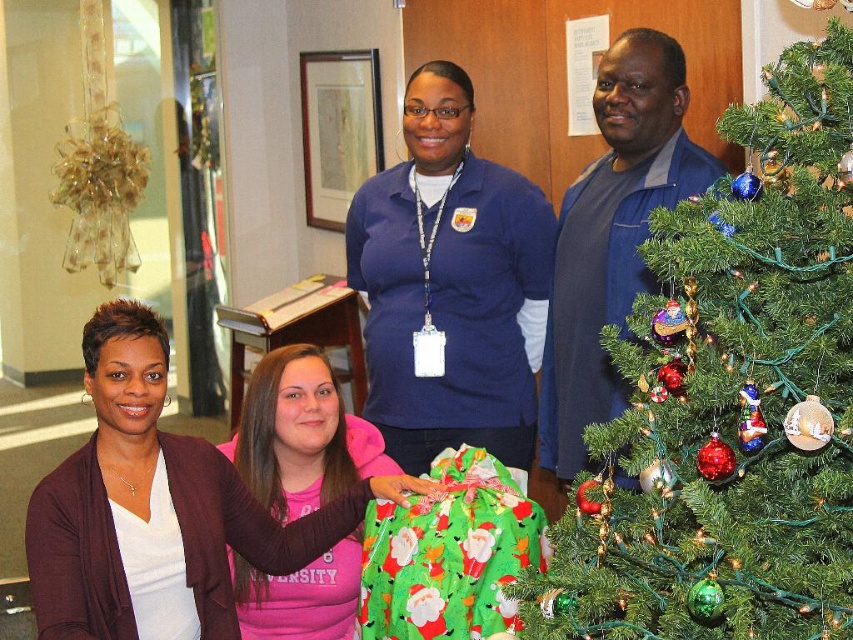
Question: Does green textured christmas tree at right appear on the left side of matte blue shirt at center?

Choices:
 (A) yes
 (B) no

Answer: (B)

Question: Is green textured christmas tree at right below blue cotton shirt at center?

Choices:
 (A) no
 (B) yes

Answer: (B)

Question: Does matte blue shirt at center have a larger size compared to matte white shirt at center?

Choices:
 (A) yes
 (B) no

Answer: (B)

Question: Among these points, which one is nearest to the camera?

Choices:
 (A) (244, 540)
 (B) (413, 243)
 (C) (270, 365)
 (D) (579, 429)

Answer: (A)

Question: Considering the real-world distances, which object is farthest from the matte white shirt at center?

Choices:
 (A) matte blue shirt at center
 (B) green textured christmas tree at right
 (C) blue cotton shirt at center

Answer: (B)

Question: Which point is farther to the camera?

Choices:
 (A) (381, 177)
 (B) (556, 634)

Answer: (A)